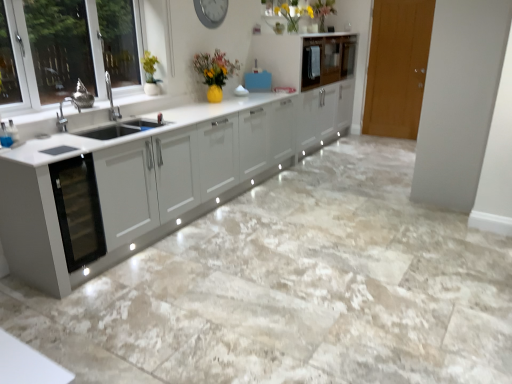
Question: Would you say glossy wood cabinet at upper center, the 1th cabinetry when ordered from front to back, is to the left or to the right of metallic gray clock at upper center in the picture?

Choices:
 (A) right
 (B) left

Answer: (A)

Question: From a real-world perspective, relative to metallic gray clock at upper center, is glossy wood cabinet at upper center, the 1th cabinetry when ordered from front to back, vertically above or below?

Choices:
 (A) below
 (B) above

Answer: (A)

Question: Which object is positioned closest to the metallic gray clock at upper center?

Choices:
 (A) glossy wood cabinet at upper center, the 1th cabinetry when ordered from front to back
 (B) glossy white cabinet at upper center, which is the 1th cabinetry from back to front
 (C) wooden door at right
 (D) matte yellow vase at upper center

Answer: (D)

Question: Considering the real-world distances, which object is closest to the glossy wood cabinet at upper center, the 1th cabinetry when ordered from front to back?

Choices:
 (A) metallic gray clock at upper center
 (B) matte yellow vase at upper center
 (C) wooden door at right
 (D) glossy white cabinet at upper center, which is the second cabinetry in front-to-back order

Answer: (D)